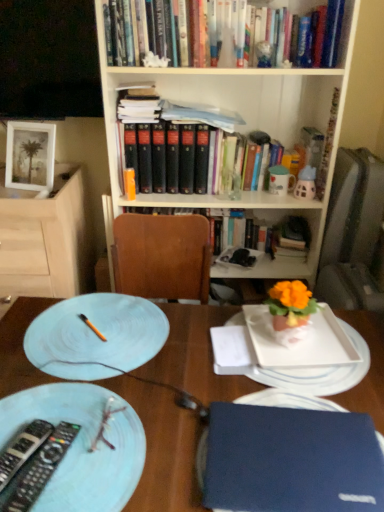
The image size is (384, 512). Find the location of `vacant area that lies between blue hardcover book at lower right and black plastic remote control at lower left`. vacant area that lies between blue hardcover book at lower right and black plastic remote control at lower left is located at coordinates (136, 461).